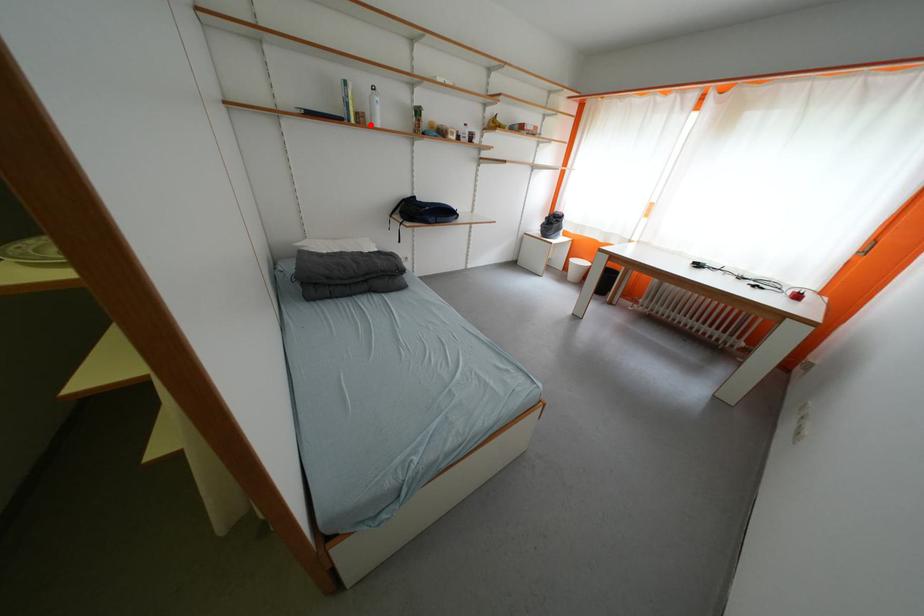
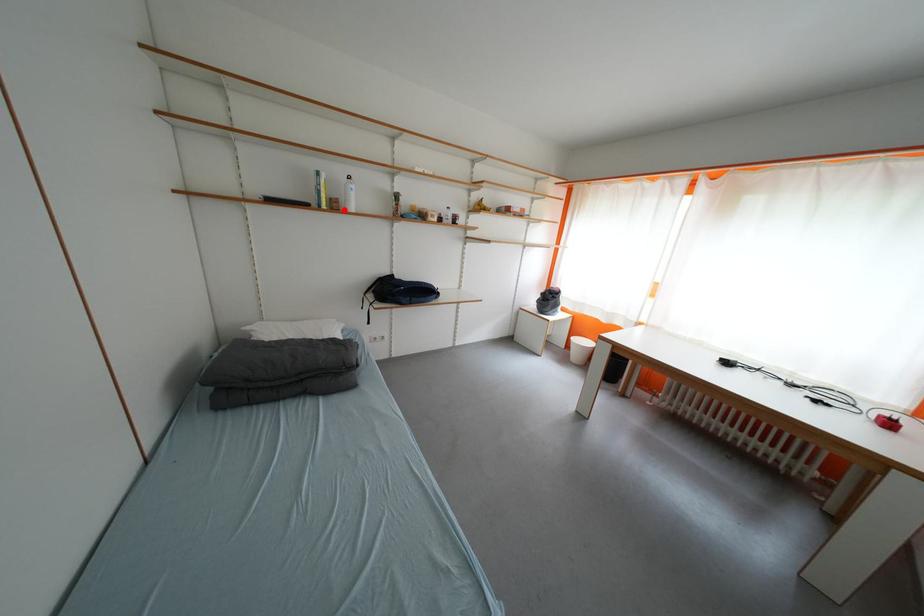
I am providing you with two images of the same scene from different viewpoints. A red point is marked on the first image and another point is marked on the second image. Is the red point in image1 aligned with the point shown in image2?

Yes